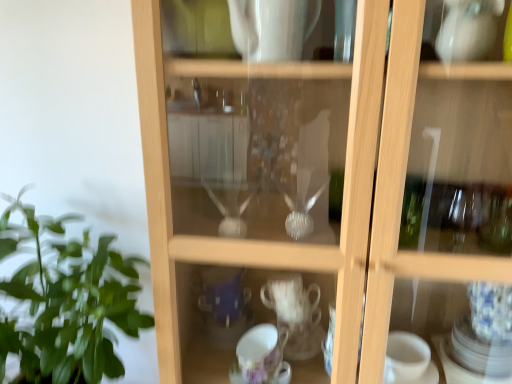
Identify the location of green leafy plant at left. (66, 302).

Describe the element at coordinates (66, 302) in the screenshot. I see `green leafy plant at left` at that location.

Measure the distance between green leafy plant at left and camera.

The depth of green leafy plant at left is 31.25 inches.

The image size is (512, 384). What are the coordinates of `transparent glass cup at center` in the screenshot? It's located at (322, 185).

The height and width of the screenshot is (384, 512). What do you see at coordinates (322, 185) in the screenshot?
I see `transparent glass cup at center` at bounding box center [322, 185].

Image resolution: width=512 pixels, height=384 pixels. I want to click on green leafy plant at left, so click(66, 302).

Can you confirm if transparent glass cup at center is positioned to the left of green leafy plant at left?

No, transparent glass cup at center is not to the left of green leafy plant at left.

Is the depth of transparent glass cup at center less than that of green leafy plant at left?

Yes.

Considering the positions of points (180, 135) and (133, 275), is point (180, 135) closer to camera compared to point (133, 275)?

Yes, it is in front of point (133, 275).

From the image's perspective, which one is positioned lower, transparent glass cup at center or green leafy plant at left?

green leafy plant at left appears lower in the image.

From a real-world perspective, is transparent glass cup at center over green leafy plant at left?

Yes, from a real-world perspective, transparent glass cup at center is over green leafy plant at left

From the picture: Does transparent glass cup at center have a lesser width compared to green leafy plant at left?

Yes, transparent glass cup at center is thinner than green leafy plant at left.

Can you confirm if transparent glass cup at center is taller than green leafy plant at left?

Yes, transparent glass cup at center is taller than green leafy plant at left.

Between transparent glass cup at center and green leafy plant at left, which one has smaller size?

green leafy plant at left.

Is transparent glass cup at center completely or partially outside of green leafy plant at left?

Yes, transparent glass cup at center is outside of green leafy plant at left.

Are transparent glass cup at center and green leafy plant at left beside each other?

No, transparent glass cup at center is not beside green leafy plant at left.

Is transparent glass cup at center aimed at green leafy plant at left?

No, transparent glass cup at center is not facing towards green leafy plant at left.

What's the angular difference between transparent glass cup at center and green leafy plant at left's facing directions?

The facing directions of transparent glass cup at center and green leafy plant at left are 3.24 degrees apart.

How much distance is there between transparent glass cup at center and green leafy plant at left?

→ A distance of 14.75 inches exists between transparent glass cup at center and green leafy plant at left.

I want to click on cupboard that is above the green leafy plant at left (from the image's perspective), so click(x=322, y=185).

Which is more to the left, green leafy plant at left or transparent glass cup at center?

green leafy plant at left is more to the left.

Is green leafy plant at left in front of transparent glass cup at center?

No, green leafy plant at left is further to the viewer.

Between point (58, 369) and point (142, 112), which one is positioned behind?

The point (58, 369) is more distant.

From the image's perspective, which is below, green leafy plant at left or transparent glass cup at center?

From the image's view, green leafy plant at left is below.

From a real-world perspective, between green leafy plant at left and transparent glass cup at center, who is vertically lower?

green leafy plant at left.

Considering the relative sizes of green leafy plant at left and transparent glass cup at center in the image provided, is green leafy plant at left wider than transparent glass cup at center?

Indeed, green leafy plant at left has a greater width compared to transparent glass cup at center.

Between green leafy plant at left and transparent glass cup at center, which one has more height?

With more height is transparent glass cup at center.

Looking at this image, in terms of size, does green leafy plant at left appear bigger or smaller than transparent glass cup at center?

Considering their sizes, green leafy plant at left takes up less space than transparent glass cup at center.

Is green leafy plant at left located outside transparent glass cup at center?

Yes, green leafy plant at left is not within transparent glass cup at center.

Does green leafy plant at left touch transparent glass cup at center?

They are not placed beside each other.

Is green leafy plant at left aimed at transparent glass cup at center?

No, green leafy plant at left does not turn towards transparent glass cup at center.

This screenshot has height=384, width=512. In the image, there is a transparent glass cup at center. In order to click on houseplant below it (from the image's perspective) in this screenshot , I will do `click(66, 302)`.

Find the location of `houseplant lying behind the transparent glass cup at center`. houseplant lying behind the transparent glass cup at center is located at coordinates (66, 302).

Where is `houseplant on the left of the transparent glass cup at center`? houseplant on the left of the transparent glass cup at center is located at coordinates (66, 302).